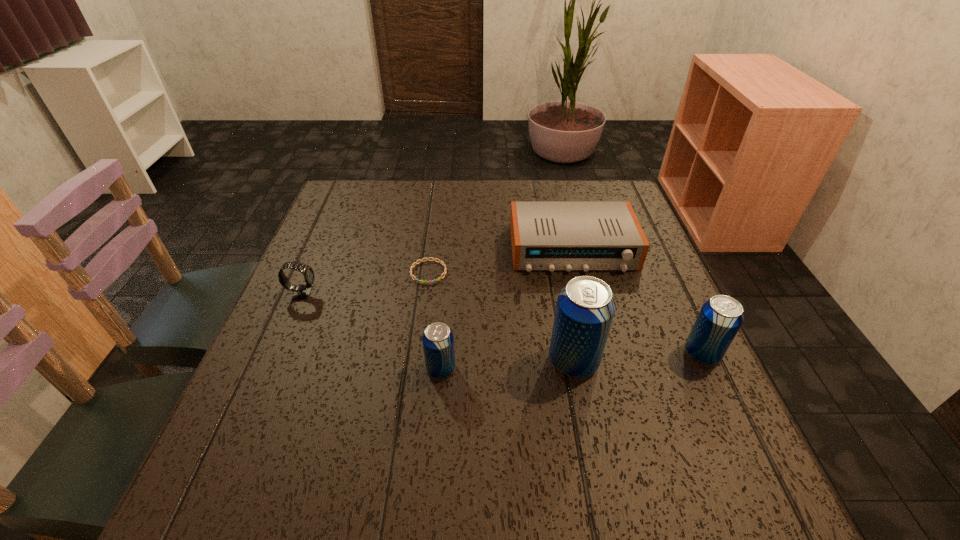
Locate an element on the screen. The image size is (960, 540). blank space that satisfies the following two spatial constraints: 1. on the control panel of the radio receiver; 2. on the face of the leftmost object is located at coordinates (584, 294).

Where is `vacant point that satisfies the following two spatial constraints: 1. on the control panel of the second shortest object; 2. on the face of the watch`? vacant point that satisfies the following two spatial constraints: 1. on the control panel of the second shortest object; 2. on the face of the watch is located at coordinates click(584, 294).

Find the location of a particular element. Image resolution: width=960 pixels, height=540 pixels. free space that satisfies the following two spatial constraints: 1. on the surface of the leftmost beer can showing star-shaped elements; 2. on the left side of the shortest object is located at coordinates (416, 369).

Locate an element on the screen. The height and width of the screenshot is (540, 960). vacant space that satisfies the following two spatial constraints: 1. on the surface of the fourth shortest object showing star-shaped elements; 2. on the left side of the shortest object is located at coordinates (416, 369).

The width and height of the screenshot is (960, 540). Find the location of `free space that satisfies the following two spatial constraints: 1. on the face of the watch; 2. on the right side of the tallest object`. free space that satisfies the following two spatial constraints: 1. on the face of the watch; 2. on the right side of the tallest object is located at coordinates (274, 361).